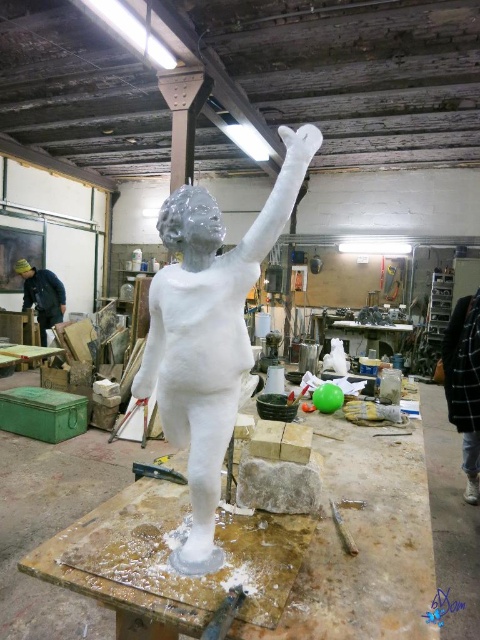
Can you confirm if white matte statue at center is wider than metallic silver tool at lower center?

Correct, the width of white matte statue at center exceeds that of metallic silver tool at lower center.

Which is in front, point (229, 397) or point (333, 504)?

Point (229, 397)

This screenshot has height=640, width=480. In order to click on white matte statue at center in this screenshot , I will do `click(208, 332)`.

Does black checkered jacket at right appear under metallic silver tool at lower center?

Actually, black checkered jacket at right is above metallic silver tool at lower center.

Describe the element at coordinates (465, 384) in the screenshot. The height and width of the screenshot is (640, 480). I see `black checkered jacket at right` at that location.

Where is `black checkered jacket at right`? black checkered jacket at right is located at coordinates (465, 384).

Does white matte statue at center have a greater width compared to matte black jacket at left?

No.

Which is below, white matte statue at center or matte black jacket at left?

Positioned lower is white matte statue at center.

Find the location of a particular element. This screenshot has width=480, height=640. white matte statue at center is located at coordinates (208, 332).

Where is `white matte statue at center`? Image resolution: width=480 pixels, height=640 pixels. white matte statue at center is located at coordinates (208, 332).